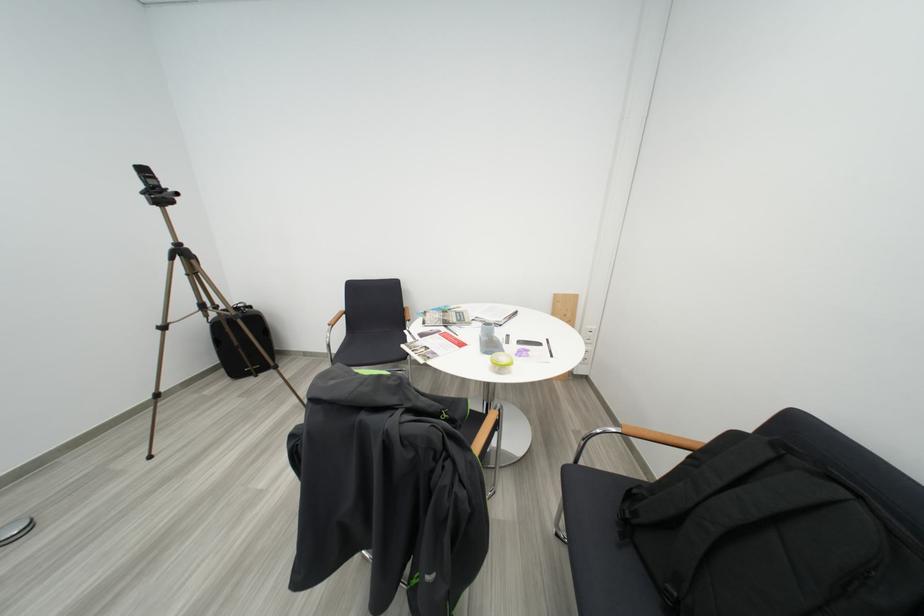
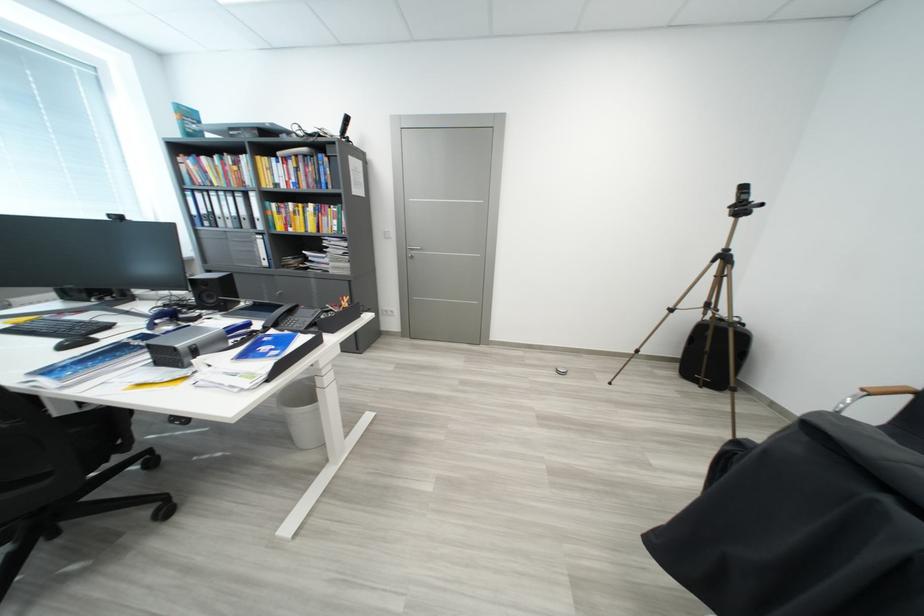
Question: I am providing you with two images of the same scene from different viewpoints. After the viewpoint changes to image2, which objects are now occluded?

Choices:
 (A) silver door handle
 (B) white trash can
 (C) round floor object
 (D) none of these

Answer: (D)